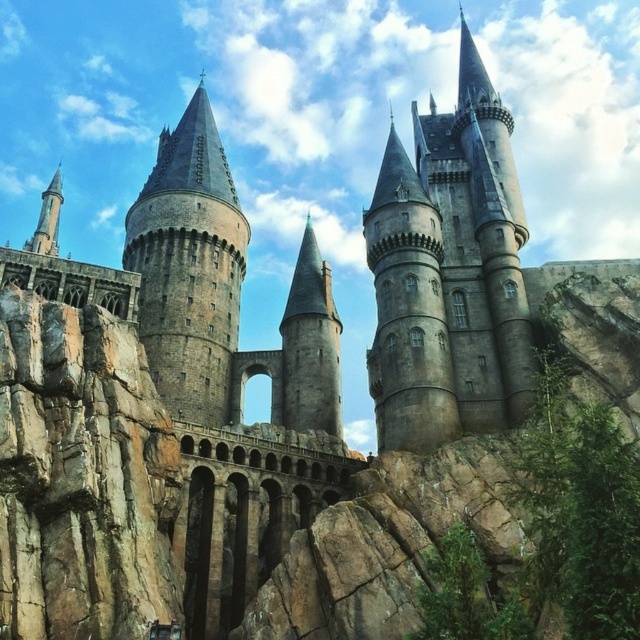
Question: Considering the relative positions of gray stone tower at center and smooth gray stone tower at center in the image provided, where is gray stone tower at center located with respect to smooth gray stone tower at center?

Choices:
 (A) left
 (B) right

Answer: (B)

Question: In this image, where is gray stone tower at center located relative to smooth gray stone tower at center?

Choices:
 (A) left
 (B) right

Answer: (B)

Question: Which object is positioned farthest from the stone gray tower at center?

Choices:
 (A) gray stone tower at center
 (B) smooth gray stone tower at center

Answer: (A)

Question: Which object is positioned farthest from the smooth gray stone tower at center?

Choices:
 (A) gray stone tower at center
 (B) stone gray tower at center

Answer: (A)

Question: Where is gray stone tower at center located in relation to stone gray tower at center in the image?

Choices:
 (A) below
 (B) above

Answer: (B)

Question: Which of the following is the closest to the observer?

Choices:
 (A) stone gray tower at center
 (B) gray stone tower at center

Answer: (B)